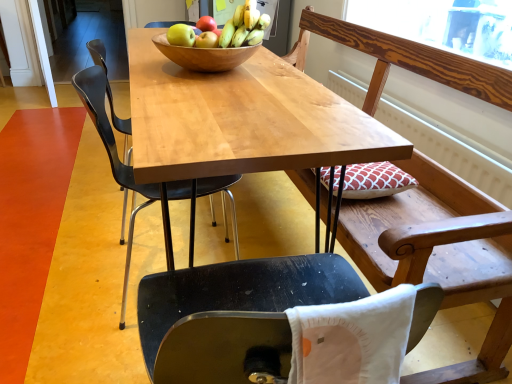
You are a GUI agent. You are given a task and a screenshot of the screen. Output one action in this format:
    pyautogui.click(x=<x>, y=<y>)
    Task: Click on the wooden table at center
    The width and height of the screenshot is (512, 384).
    Given the screenshot: What is the action you would take?
    pyautogui.click(x=242, y=119)

You are a GUI agent. You are given a task and a screenshot of the screen. Output one action in this format:
    pyautogui.click(x=<x>, y=<y>)
    Task: Click on the yellow matte bananas at center
    
    Given the screenshot: What is the action you would take?
    pyautogui.click(x=244, y=26)

This screenshot has height=384, width=512. What do you see at coordinates (181, 35) in the screenshot?
I see `matte green apple at center, the 2th apple in the back-to-front sequence` at bounding box center [181, 35].

This screenshot has height=384, width=512. What do you see at coordinates (425, 229) in the screenshot? I see `wooden bench at upper right` at bounding box center [425, 229].

Locate an element on the screen. The height and width of the screenshot is (384, 512). wooden table at center is located at coordinates (242, 119).

Based on the photo, would you say matte green apple at center, which appears as the 2th apple when viewed from the front, is outside white fabric pillow at lower center?

matte green apple at center, which appears as the 2th apple when viewed from the front, lies outside white fabric pillow at lower center's area.

Measure the distance between matte green apple at center, the 2th apple in the back-to-front sequence, and white fabric pillow at lower center.

They are 1.03 meters apart.

Which is closer, (175, 27) or (298, 307)?

The point (298, 307) is more forward.

Can you confirm if matte green apple at center, the 2th apple in the back-to-front sequence, is smaller than white fabric pillow at lower center?

Indeed, matte green apple at center, the 2th apple in the back-to-front sequence, has a smaller size compared to white fabric pillow at lower center.

How many degrees apart are the facing directions of matte green apple at center, which appears as the 2th apple when viewed from the front, and matte yellow apple at center, which is the third apple from back to front?

The angular difference between matte green apple at center, which appears as the 2th apple when viewed from the front, and matte yellow apple at center, which is the third apple from back to front, is 180 degrees.

How distant is matte green apple at center, the 2th apple in the back-to-front sequence, from matte yellow apple at center, which is the third apple from back to front?

2.38 inches.

Is point (185, 36) closer or farther from the camera than point (215, 43)?

Point (185, 36).

From a real-world perspective, is matte green apple at center, which appears as the 2th apple when viewed from the front, beneath matte yellow apple at center, the 1th apple viewed from the front?

Yes, from a real-world perspective, matte green apple at center, which appears as the 2th apple when viewed from the front, is under matte yellow apple at center, the 1th apple viewed from the front.

Is matte yellow apple at center, the 1th apple viewed from the front, taller than matte green apple at center, the 2th apple in the back-to-front sequence?

Incorrect, the height of matte yellow apple at center, the 1th apple viewed from the front, is not larger of that of matte green apple at center, the 2th apple in the back-to-front sequence.

From a real-world perspective, is matte yellow apple at center, which is the third apple from back to front, located beneath matte green apple at center, the 2th apple in the back-to-front sequence?

No, from a real-world perspective, matte yellow apple at center, which is the third apple from back to front, is not below matte green apple at center, the 2th apple in the back-to-front sequence.

How many degrees apart are the facing directions of matte yellow apple at center, which is the third apple from back to front, and matte green apple at center, which appears as the 2th apple when viewed from the front?

The angle between the facing direction of matte yellow apple at center, which is the third apple from back to front, and the facing direction of matte green apple at center, which appears as the 2th apple when viewed from the front, is 180 degrees.

Which is more to the right, wooden bench at upper right or matte yellow apple at center, the 1th apple viewed from the front?

wooden bench at upper right is more to the right.

What's the angular difference between wooden bench at upper right and matte yellow apple at center, the 1th apple viewed from the front,'s facing directions?

They differ by 94.3 degrees in their facing directions.

Between wooden bench at upper right and matte yellow apple at center, which is the third apple from back to front, which one is positioned in front?

Positioned in front is wooden bench at upper right.

From the image's perspective, is wooden bench at upper right above matte yellow apple at center, the 1th apple viewed from the front?

No, from the image's perspective, wooden bench at upper right is not over matte yellow apple at center, the 1th apple viewed from the front.

Is point (337, 380) closer to camera compared to point (192, 42)?

That is True.

Is white fabric pillow at lower center positioned behind matte green apple at center, which appears as the 2th apple when viewed from the front?

No, white fabric pillow at lower center is in front of matte green apple at center, which appears as the 2th apple when viewed from the front.

In the scene shown: Considering the sizes of white fabric pillow at lower center and matte green apple at center, the 2th apple in the back-to-front sequence, in the image, is white fabric pillow at lower center bigger or smaller than matte green apple at center, the 2th apple in the back-to-front sequence,?

white fabric pillow at lower center is bigger than matte green apple at center, the 2th apple in the back-to-front sequence.

Is white fabric pillow at lower center positioned with its back to matte green apple at center, the 2th apple in the back-to-front sequence?

No, white fabric pillow at lower center is not facing away from matte green apple at center, the 2th apple in the back-to-front sequence.

At what (x,y) coordinates should I click in order to perform the action: click on banana that appears on the right of wooden bowl at center. Please return your answer as a coordinate pair (x, y). Looking at the image, I should click on (244, 26).

Does yellow matte bananas at center lie in front of wooden bowl at center?

Yes, it is.

In the scene shown: Considering the relative sizes of yellow matte bananas at center and wooden bowl at center in the image provided, is yellow matte bananas at center thinner than wooden bowl at center?

Yes.

Could you tell me if yellow matte bananas at center is facing wooden bowl at center?

No.

From the image's perspective, between wooden table at center and matte yellow apple at center, which is the third apple from back to front, who is located below?

wooden table at center is shown below in the image.

Between point (273, 112) and point (202, 43), which one is positioned in front?

The point (273, 112) is closer.

At what (x,y) coordinates should I click in order to perform the action: click on pillow in front of the matte green apple at center, the 2th apple in the back-to-front sequence. Please return your answer as a coordinate pair (x, y). The image size is (512, 384). Looking at the image, I should click on (352, 339).

The height and width of the screenshot is (384, 512). I want to click on apple that is the 1st object located above the matte yellow apple at center, the 1th apple viewed from the front (from the image's perspective), so click(181, 35).

When comparing their distances from wooden bench at upper right, does matte green apple at center, which appears as the 2th apple when viewed from the front, or white fabric pillow at lower center seem closer?

white fabric pillow at lower center lies closer to wooden bench at upper right than the other object.

Considering their positions, is yellow matte bananas at center positioned further to wooden bowl at center than matte red apple at center, the third apple viewed from the front?

matte red apple at center, the third apple viewed from the front, is further to wooden bowl at center.

Based on their spatial positions, is matte yellow apple at center, the 1th apple viewed from the front, or yellow matte bananas at center further from wooden table at center?

The object further to wooden table at center is matte yellow apple at center, the 1th apple viewed from the front.

Looking at the image, which one is located further to yellow matte bananas at center, wooden bowl at center or wooden table at center?

wooden table at center is further to yellow matte bananas at center.

Looking at the image, which one is located further to wooden bowl at center, white fabric pillow at lower center or matte red apple at center, which is the 1th apple from back to front?

white fabric pillow at lower center lies further to wooden bowl at center than the other object.

Estimate the real-world distances between objects in this image. Which object is closer to wooden table at center, white fabric pillow at lower center or yellow matte bananas at center?

Based on the image, yellow matte bananas at center appears to be nearer to wooden table at center.

Considering their positions, is matte yellow apple at center, the 1th apple viewed from the front, positioned closer to matte green apple at center, which appears as the 2th apple when viewed from the front, than white fabric pillow at lower center?

matte yellow apple at center, the 1th apple viewed from the front, is positioned closer to the anchor matte green apple at center, which appears as the 2th apple when viewed from the front.

Based on their spatial positions, is wooden table at center or yellow matte bananas at center closer to wooden bowl at center?

yellow matte bananas at center is positioned closer to the anchor wooden bowl at center.

Identify the location of bench positioned between wooden table at center and matte green apple at center, the 2th apple in the back-to-front sequence, from near to far. The image size is (512, 384). (425, 229).

Find the location of `bench between white fabric pillow at lower center and matte red apple at center, which is the 1th apple from back to front, along the z-axis`. bench between white fabric pillow at lower center and matte red apple at center, which is the 1th apple from back to front, along the z-axis is located at coordinates (425, 229).

Find the location of `bench located between wooden table at center and matte red apple at center, the third apple viewed from the front, in the depth direction`. bench located between wooden table at center and matte red apple at center, the third apple viewed from the front, in the depth direction is located at coordinates (425, 229).

The height and width of the screenshot is (384, 512). I want to click on bowl between white fabric pillow at lower center and matte red apple at center, which is the 1th apple from back to front, along the z-axis, so click(204, 55).